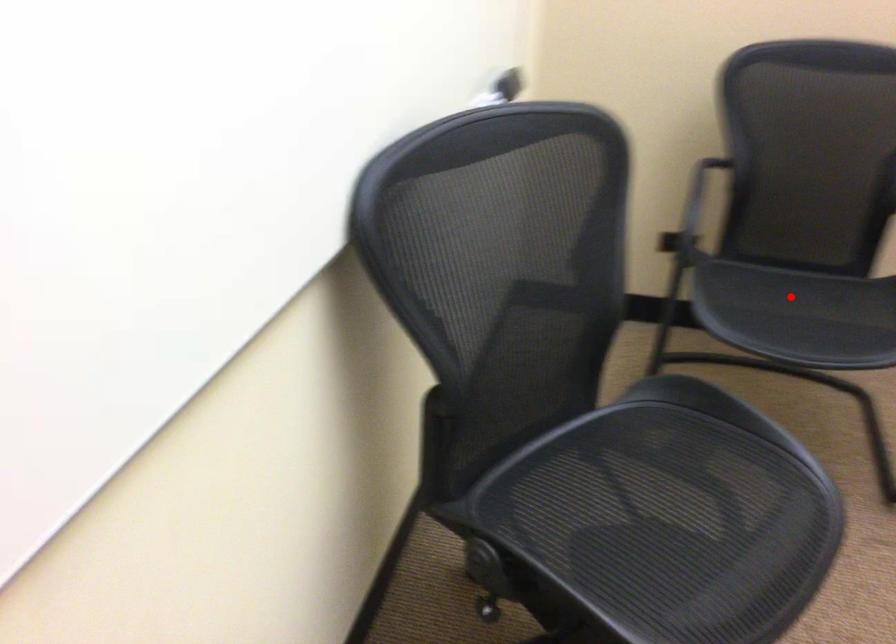
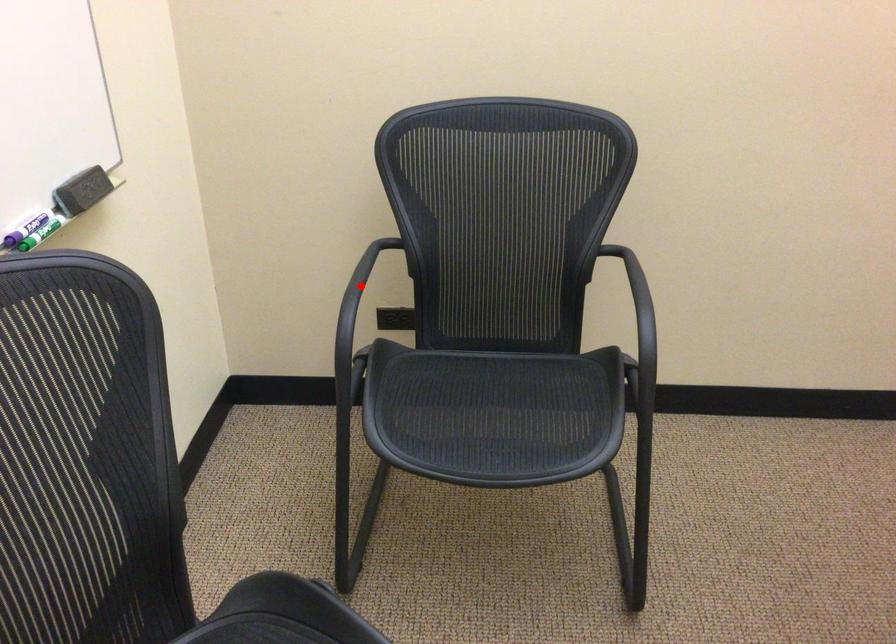
I am providing you with two images of the same scene from different viewpoints. A red point is marked on the first image and another point is marked on the second image. Do the highlighted points in image1 and image2 indicate the same real-world spot?

No